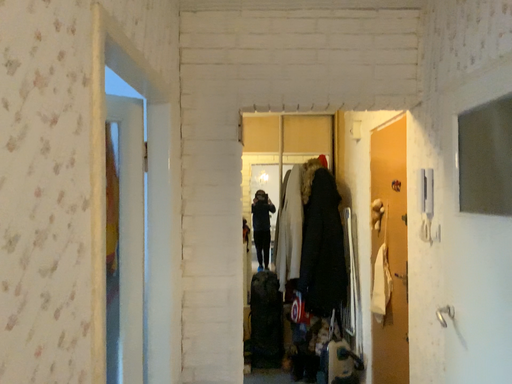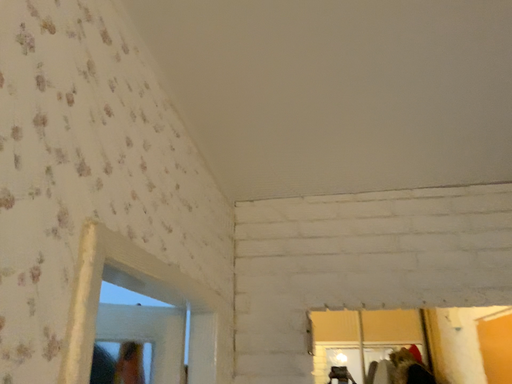
Question: How did the camera likely rotate when shooting the video?

Choices:
 (A) rotated left
 (B) rotated right

Answer: (A)